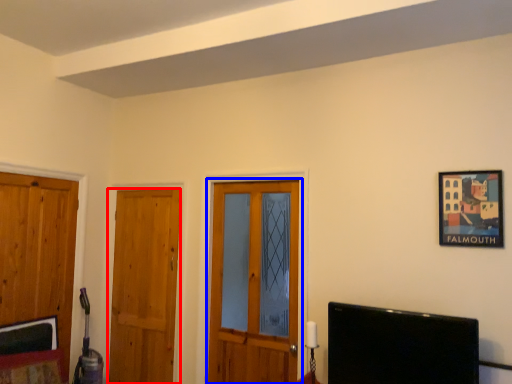
Question: Which point is further to the camera, door (highlighted by a red box) or door (highlighted by a blue box)?

Choices:
 (A) door
 (B) door

Answer: (A)